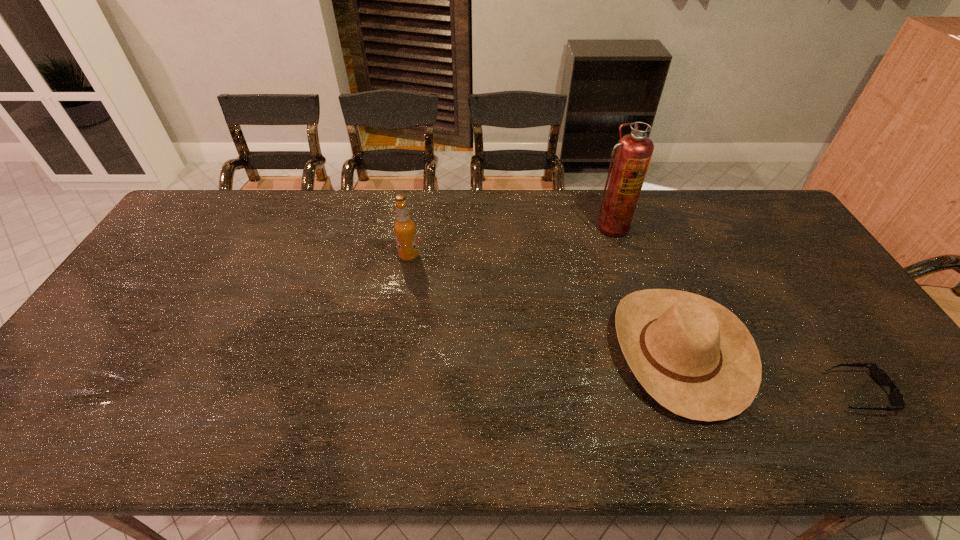
Identify the location of vacant space located 0.140m on the front-facing side of the cowboy hat. The image size is (960, 540). (559, 351).

Where is `vacant area located on the front-facing side of the cowboy hat`? The image size is (960, 540). vacant area located on the front-facing side of the cowboy hat is located at coordinates (512, 351).

Locate an element on the screen. vacant space located on the front-facing side of the sunglasses is located at coordinates (731, 393).

Where is `vacant area situated 0.270m on the front-facing side of the sunglasses`? The image size is (960, 540). vacant area situated 0.270m on the front-facing side of the sunglasses is located at coordinates (718, 393).

Locate an element on the screen. The width and height of the screenshot is (960, 540). vacant space located on the front-facing side of the sunglasses is located at coordinates (760, 393).

Where is `object at the far edge`? object at the far edge is located at coordinates pyautogui.click(x=634, y=151).

Locate an element on the screen. This screenshot has height=540, width=960. cowboy hat that is at the near edge is located at coordinates (696, 358).

Find the location of a particular element. Image resolution: width=960 pixels, height=540 pixels. sunglasses located at the near edge is located at coordinates (880, 376).

Find the location of `object positioned at the right edge`. object positioned at the right edge is located at coordinates (880, 376).

You are a GUI agent. You are given a task and a screenshot of the screen. Output one action in this format:
    pyautogui.click(x=<x>, y=<y>)
    Task: Click on the object that is positioned at the near right corner
    
    Given the screenshot: What is the action you would take?
    pyautogui.click(x=880, y=376)